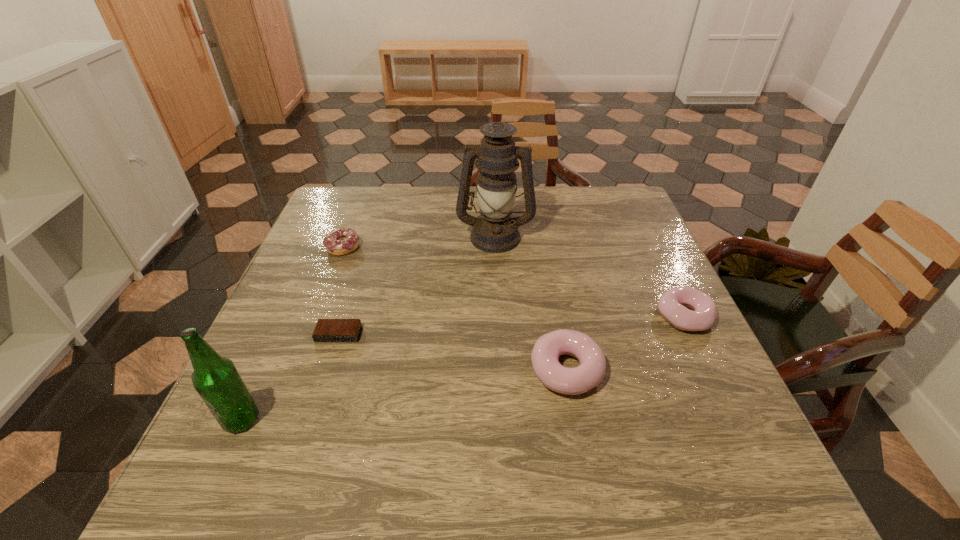
Observe the arrangement of all doughnuts in the image. To keep them evenly spaced, where would you place another doughnut on the left? Please locate a free space. Please provide its 2D coordinates. Your answer should be formatted as a tuple, i.e. [(x, y)], where the tuple contains the x and y coordinates of a point satisfying the conditions above.

[(416, 438)]